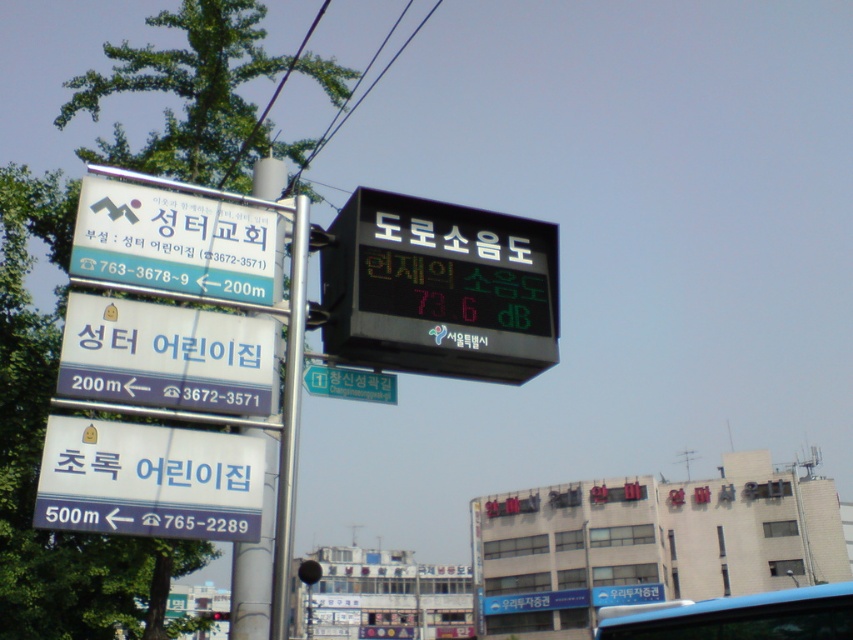
Does point (123, 472) come closer to viewer compared to point (352, 371)?

Yes.

Between point (80, 520) and point (317, 394), which one is positioned in front?

Positioned in front is point (80, 520).

Who is more forward, (x=178, y=444) or (x=337, y=372)?

Point (x=178, y=444) is more forward.

I want to click on white plastic sign at lower left, so [x=149, y=481].

Does white plastic sign at left have a lesser width compared to white plastic sign at upper left?

Yes.

Between white plastic sign at left and white plastic sign at upper left, which one has more height?

Standing taller between the two is white plastic sign at upper left.

At what (x,y) coordinates should I click in order to perform the action: click on white plastic sign at left. Please return your answer as a coordinate pair (x, y). Looking at the image, I should click on (167, 356).

At what (x,y) coordinates should I click in order to perform the action: click on white plastic sign at left. Please return your answer as a coordinate pair (x, y). Image resolution: width=853 pixels, height=640 pixels. Looking at the image, I should click on (167, 356).

From the picture: Is black electronic display at upper center below white plastic sign at lower left?

No.

Who is positioned more to the left, black electronic display at upper center or white plastic sign at lower left?

Positioned to the left is white plastic sign at lower left.

Which is behind, point (463, 369) or point (51, 422)?

The point (463, 369) is behind.

Find the location of a particular element. The width and height of the screenshot is (853, 640). black electronic display at upper center is located at coordinates (439, 289).